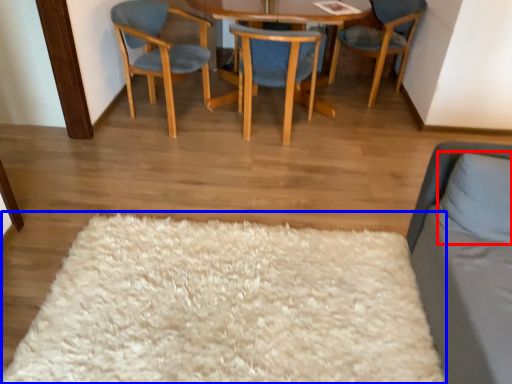
Question: Among these objects, which one is nearest to the camera, pillow (highlighted by a red box) or mat (highlighted by a blue box)?

Choices:
 (A) pillow
 (B) mat

Answer: (B)